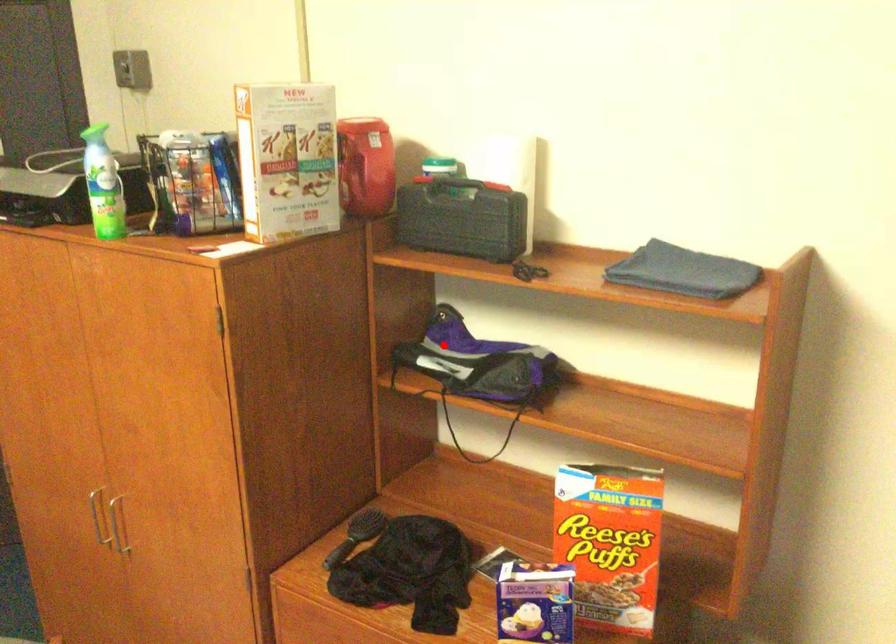
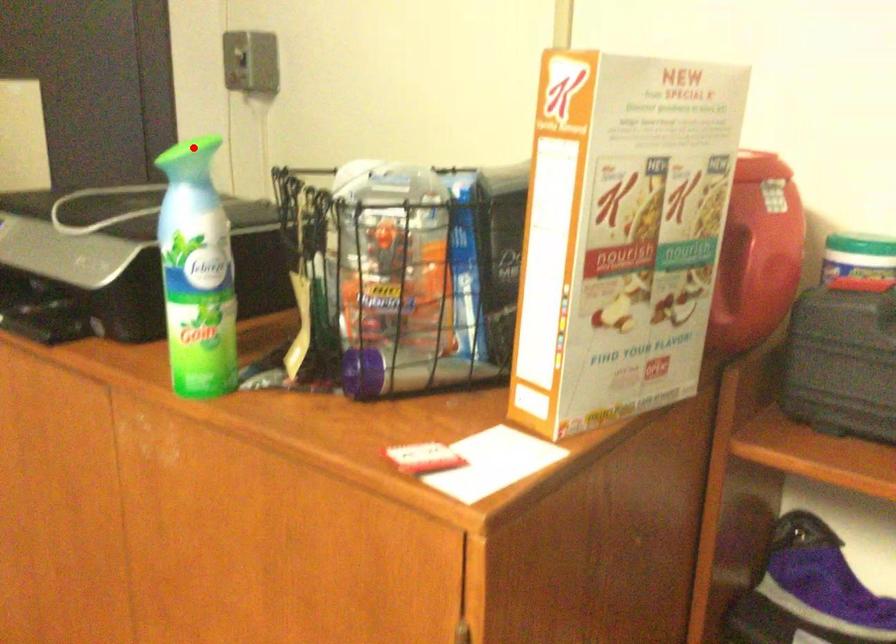
I am providing you with two images of the same scene from different viewpoints. A red point is marked on the first image and another point is marked on the second image. Is the red point in image1 aligned with the point shown in image2?

No